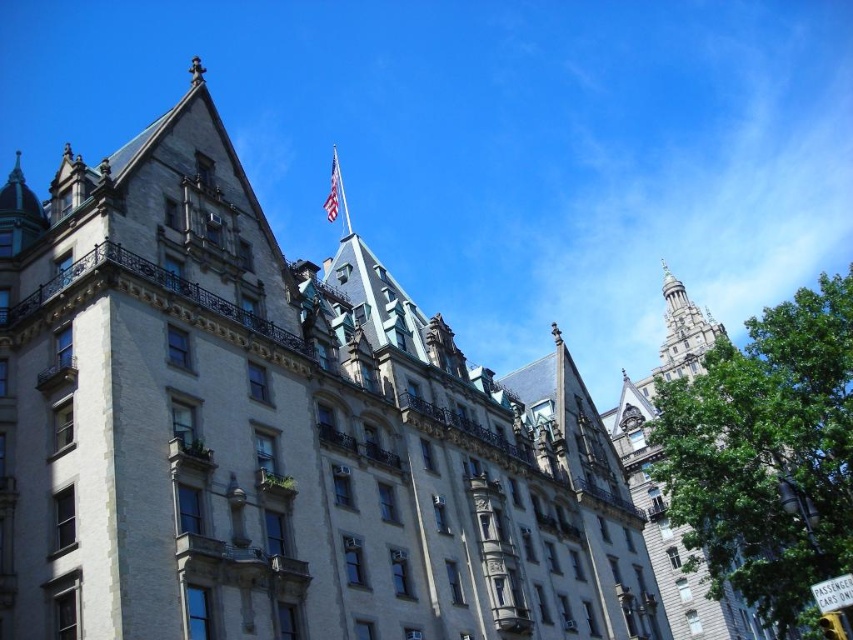
Does white stone building at center appear on the left side of stone tower at upper right?

Indeed, white stone building at center is positioned on the left side of stone tower at upper right.

Does white stone building at center lie behind stone tower at upper right?

That is False.

Between point (606, 490) and point (680, 312), which one is positioned in front?

Point (606, 490) is in front.

This screenshot has height=640, width=853. I want to click on white stone building at center, so click(276, 432).

Is stone tower at upper right below american flag at upper center?

Yes.

Can you confirm if stone tower at upper right is smaller than american flag at upper center?

No, stone tower at upper right is not smaller than american flag at upper center.

Where is `stone tower at upper right`? The height and width of the screenshot is (640, 853). stone tower at upper right is located at coordinates (663, 484).

This screenshot has width=853, height=640. What are the coordinates of `stone tower at upper right` in the screenshot? It's located at pos(663,484).

Between white stone building at center and american flag at upper center, which one appears on the left side from the viewer's perspective?

From the viewer's perspective, white stone building at center appears more on the left side.

Does white stone building at center appear on the right side of american flag at upper center?

Incorrect, white stone building at center is not on the right side of american flag at upper center.

Is point (22, 600) behind point (335, 148)?

No, (22, 600) is closer to viewer.

Where is `white stone building at center`? The image size is (853, 640). white stone building at center is located at coordinates (276, 432).